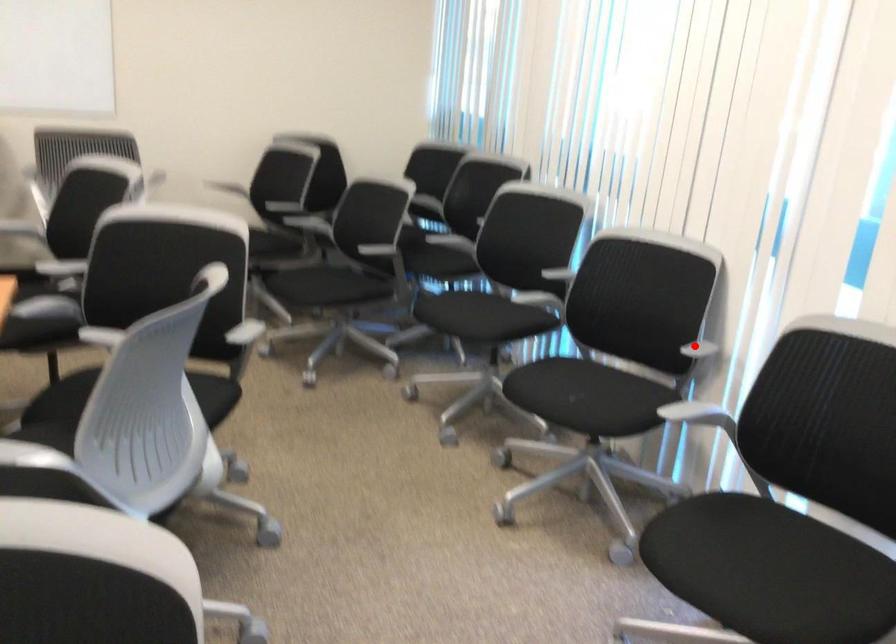
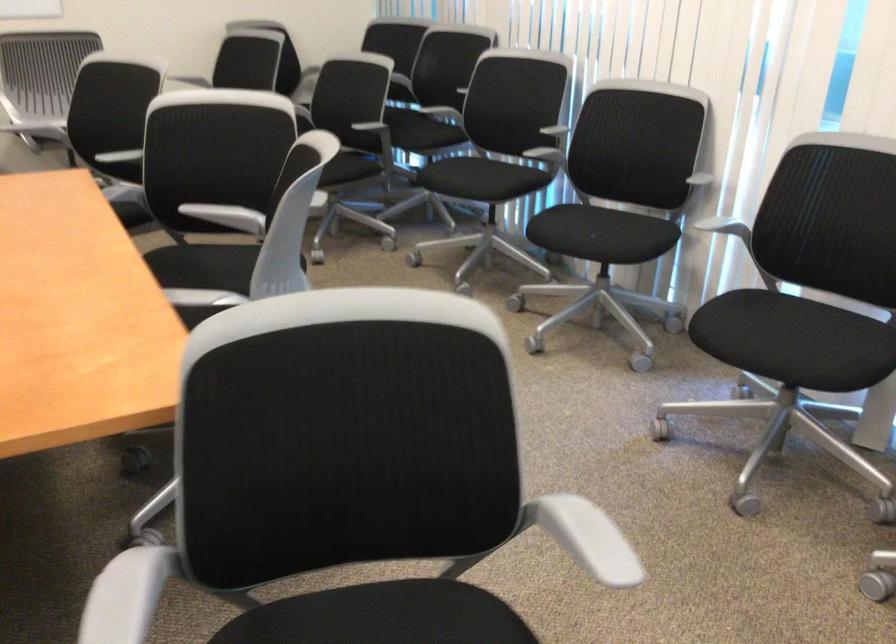
Question: I am providing you with two images of the same scene from different viewpoints. Given a red point in image1, look at the same physical point in image2. Is it:

Choices:
 (A) Closer to the viewpoint
 (B) Farther from the viewpoint

Answer: (B)